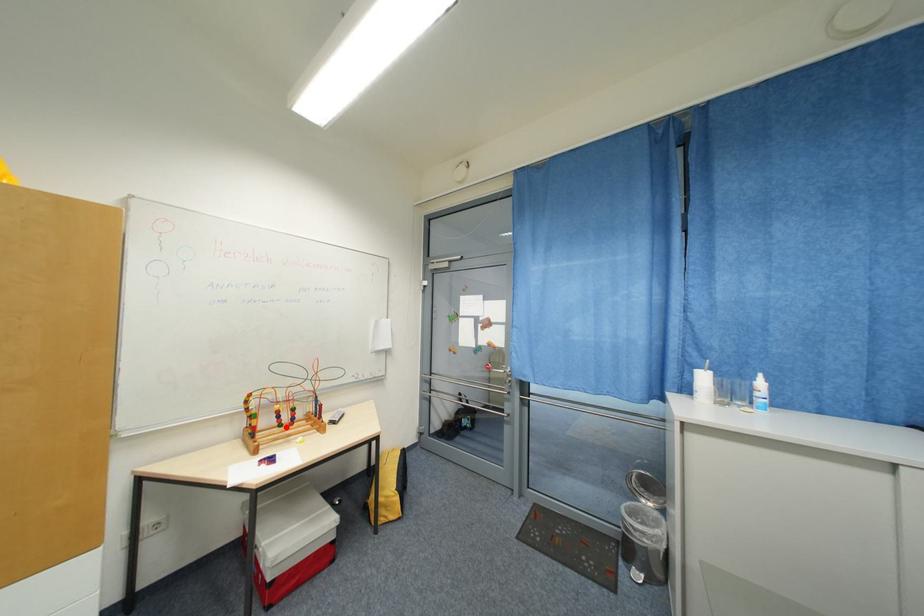
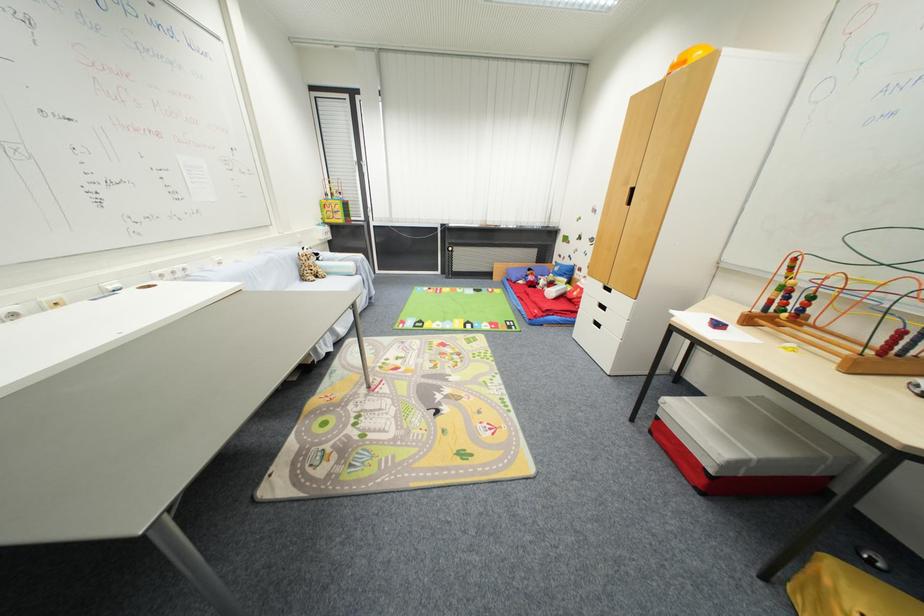
Question: I am providing you with two images of the same scene from different viewpoints. A red point is marked on the first image. Is the red point's position out of view in image 2?

Choices:
 (A) Yes
 (B) No

Answer: (B)